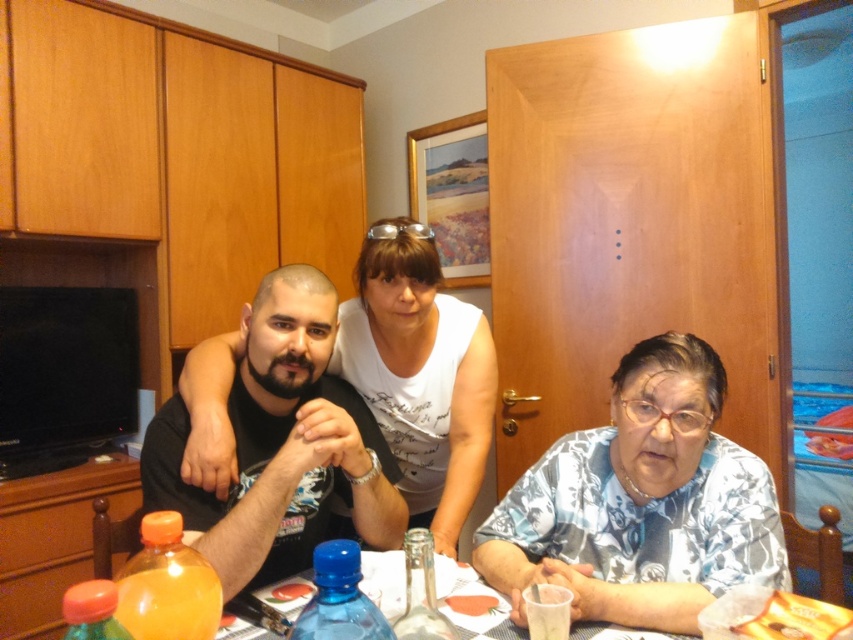
Which of these two, orange matte bottle at lower left or silver metallic glasses at upper center, stands shorter?

With less height is silver metallic glasses at upper center.

Does point (155, 586) lie behind point (422, 225)?

No, it is in front of (422, 225).

You are a GUI agent. You are given a task and a screenshot of the screen. Output one action in this format:
    pyautogui.click(x=<x>, y=<y>)
    Task: Click on the orange matte bottle at lower left
    
    Given the screenshot: What is the action you would take?
    pyautogui.click(x=167, y=586)

Locate an element on the screen. The image size is (853, 640). orange matte bottle at lower left is located at coordinates (167, 586).

Between point (175, 561) and point (361, 625), which one is positioned behind?

Point (175, 561)

Consider the image. Who is taller, orange matte bottle at lower left or blue plastic bottle at lower center?

orange matte bottle at lower left

The image size is (853, 640). Describe the element at coordinates (167, 586) in the screenshot. I see `orange matte bottle at lower left` at that location.

Where is `orange matte bottle at lower left`? This screenshot has height=640, width=853. orange matte bottle at lower left is located at coordinates (167, 586).

Who is positioned more to the left, smooth salmon fillet at center or translucent plastic cup at lower center?

From the viewer's perspective, translucent plastic cup at lower center appears more on the left side.

Does point (473, 608) come farther from viewer compared to point (297, 586)?

No, it is in front of (297, 586).

At what (x,y) coordinates should I click in order to perform the action: click on smooth salmon fillet at center. Please return your answer as a coordinate pair (x, y). This screenshot has width=853, height=640. Looking at the image, I should click on (471, 604).